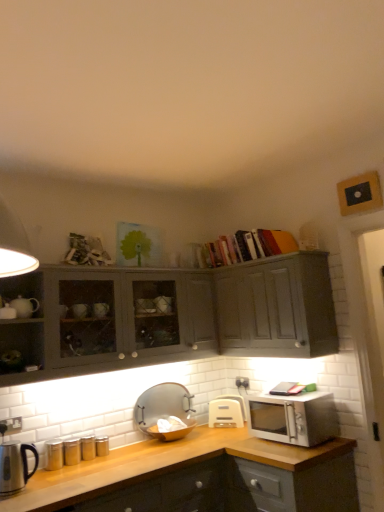
Question: Does matte gray cabinet at upper right, acting as the first cabinetry starting from the right, appear on the left side of white plastic electric outlet at lower left?

Choices:
 (A) yes
 (B) no

Answer: (B)

Question: Considering the relative sizes of matte gray cabinet at upper right, marked as the 2th cabinetry in a left-to-right arrangement, and white plastic electric outlet at lower left in the image provided, is matte gray cabinet at upper right, marked as the 2th cabinetry in a left-to-right arrangement, smaller than white plastic electric outlet at lower left?

Choices:
 (A) yes
 (B) no

Answer: (B)

Question: Is the position of matte gray cabinet at upper right, marked as the 2th cabinetry in a left-to-right arrangement, less distant than that of white plastic electric outlet at lower left?

Choices:
 (A) yes
 (B) no

Answer: (B)

Question: Is the surface of matte gray cabinet at upper right, acting as the first cabinetry starting from the right, in direct contact with white plastic electric outlet at lower left?

Choices:
 (A) yes
 (B) no

Answer: (B)

Question: Is white plastic electric outlet at lower left completely or partially inside matte gray cabinet at upper right, marked as the 2th cabinetry in a left-to-right arrangement?

Choices:
 (A) no
 (B) yes

Answer: (A)

Question: Considering the positions of point (56, 266) and point (286, 327), is point (56, 266) closer or farther from the camera than point (286, 327)?

Choices:
 (A) closer
 (B) farther

Answer: (A)

Question: Looking at the image, does matte gray cabinet at upper left, the 1th cabinetry when ordered from left to right, seem bigger or smaller compared to matte gray cabinet at upper right, acting as the first cabinetry starting from the right?

Choices:
 (A) big
 (B) small

Answer: (A)

Question: Is matte gray cabinet at upper left, the 1th cabinetry when ordered from left to right, situated inside matte gray cabinet at upper right, acting as the first cabinetry starting from the right, or outside?

Choices:
 (A) outside
 (B) inside

Answer: (A)

Question: In the image, is matte gray cabinet at upper left, which is the second cabinetry from right to left, positioned in front of or behind matte gray cabinet at upper right, marked as the 2th cabinetry in a left-to-right arrangement?

Choices:
 (A) front
 (B) behind

Answer: (A)

Question: Based on their sizes in the image, would you say white plastic electric outlet at lower left is bigger or smaller than satin silver microwave at right?

Choices:
 (A) big
 (B) small

Answer: (B)

Question: Considering the positions of white plastic electric outlet at lower left and satin silver microwave at right in the image, is white plastic electric outlet at lower left wider or thinner than satin silver microwave at right?

Choices:
 (A) wide
 (B) thin

Answer: (B)

Question: Based on their positions, is white plastic electric outlet at lower left located to the left or right of satin silver microwave at right?

Choices:
 (A) left
 (B) right

Answer: (A)

Question: Considering the positions of point (19, 422) and point (332, 397), is point (19, 422) closer or farther from the camera than point (332, 397)?

Choices:
 (A) closer
 (B) farther

Answer: (A)

Question: In the image, is stainless steel kettle at left, the 1th appliance positioned from the left, positioned in front of or behind matte gray cabinet at upper left, the 1th cabinetry when ordered from left to right?

Choices:
 (A) behind
 (B) front

Answer: (B)

Question: Based on their positions, is stainless steel kettle at left, placed as the 3th appliance when sorted from right to left, located to the left or right of matte gray cabinet at upper left, the 1th cabinetry when ordered from left to right?

Choices:
 (A) left
 (B) right

Answer: (A)